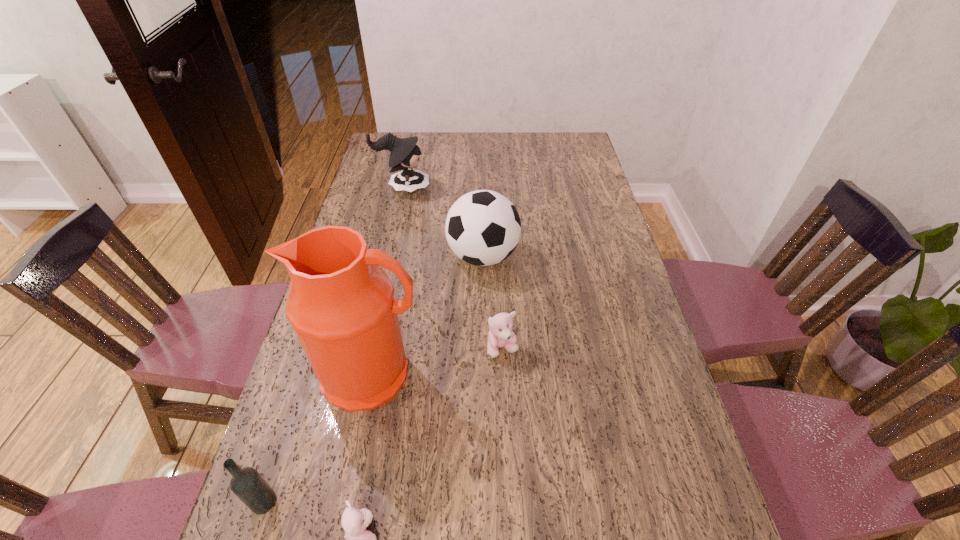
I want to click on free space that satisfies the following two spatial constraints: 1. on the back side of the soccer ball; 2. at the face of the farthest object, so click(483, 188).